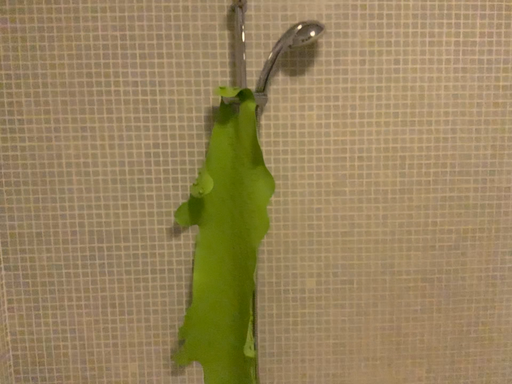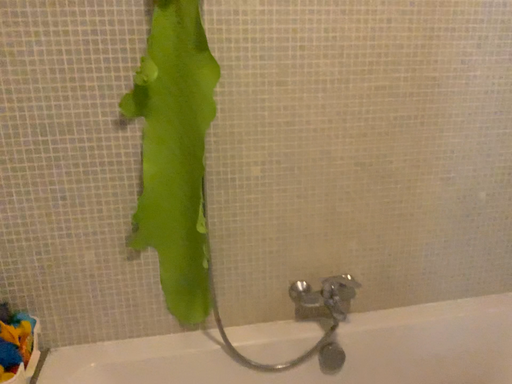
Question: Which way did the camera rotate in the video?

Choices:
 (A) rotated right
 (B) rotated left

Answer: (A)